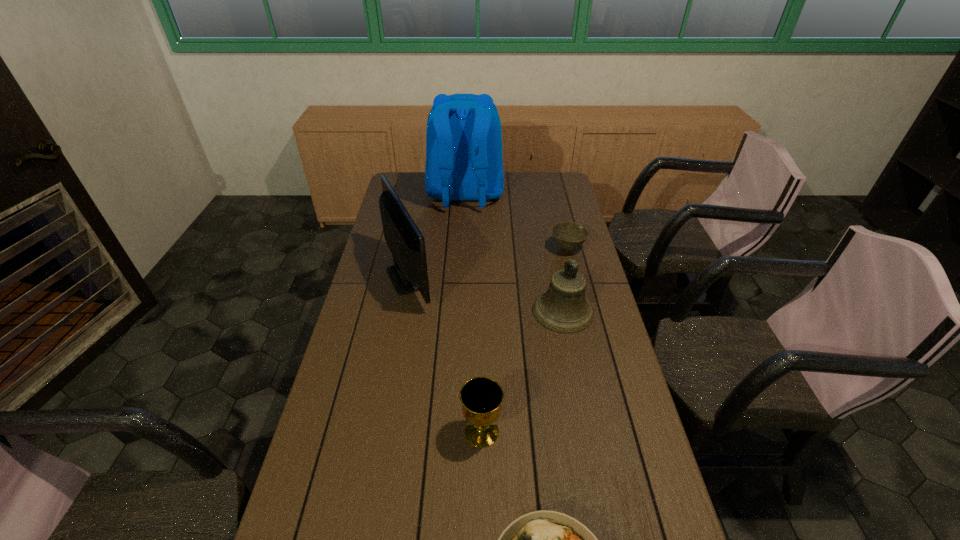
The height and width of the screenshot is (540, 960). Identify the location of vacant space positioned 0.280m on the back of the chalice. (481, 336).

Find the location of a particular element. The image size is (960, 540). vacant area located 0.330m on the back of the bowl is located at coordinates (555, 197).

Where is `object situated at the far edge`? The width and height of the screenshot is (960, 540). object situated at the far edge is located at coordinates (464, 162).

The height and width of the screenshot is (540, 960). Find the location of `object at the left edge`. object at the left edge is located at coordinates (409, 273).

Identify the location of bell that is at the right edge. (563, 308).

At what (x,y) coordinates should I click in order to perform the action: click on bowl located in the right edge section of the desktop. Please return your answer as a coordinate pair (x, y). Looking at the image, I should click on (568, 235).

I want to click on blank space at the far edge, so click(508, 186).

In the image, there is a desktop. In order to click on vacant space at the left edge in this screenshot , I will do `click(366, 280)`.

Where is `vacant space at the right edge`? Image resolution: width=960 pixels, height=540 pixels. vacant space at the right edge is located at coordinates (580, 354).

In the image, there is a desktop. Where is `free space at the far left corner`? free space at the far left corner is located at coordinates (421, 188).